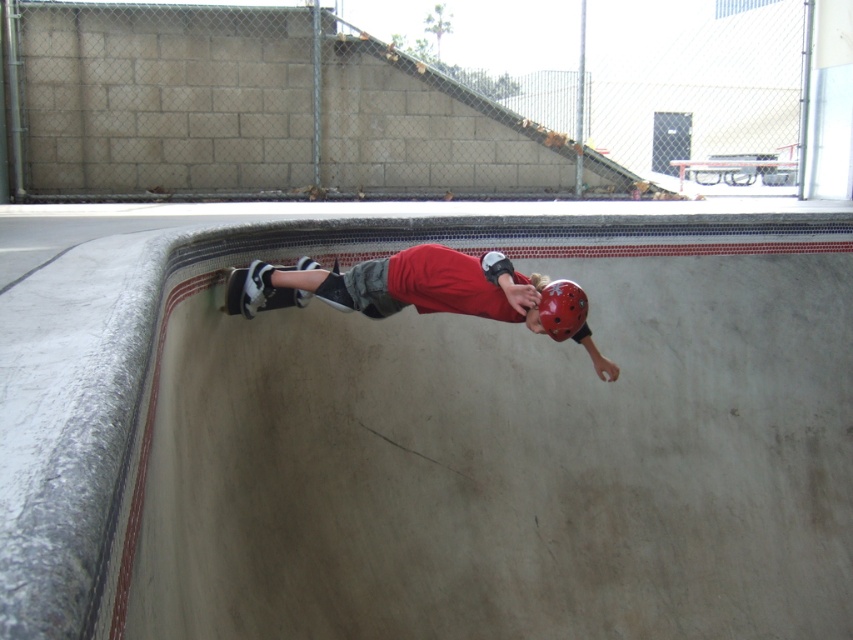
Is red matte helmet at center smaller than matte red helmet at center?

No.

Can you confirm if red matte helmet at center is positioned to the right of matte red helmet at center?

No, red matte helmet at center is not to the right of matte red helmet at center.

What do you see at coordinates (408, 285) in the screenshot? The width and height of the screenshot is (853, 640). I see `red matte helmet at center` at bounding box center [408, 285].

Where is `red matte helmet at center`? The width and height of the screenshot is (853, 640). red matte helmet at center is located at coordinates (408, 285).

Can you confirm if matte red helmet at center is smaller than white rubber skateboard at lower left?

Incorrect, matte red helmet at center is not smaller in size than white rubber skateboard at lower left.

Which is in front, point (553, 330) or point (238, 308)?

Point (553, 330) is in front.

Is point (564, 300) closer to camera compared to point (231, 312)?

Yes, point (564, 300) is in front of point (231, 312).

Find the location of a particular element. The width and height of the screenshot is (853, 640). matte red helmet at center is located at coordinates (563, 310).

Can you confirm if red matte helmet at center is thinner than white rubber skateboard at lower left?

Incorrect, red matte helmet at center's width is not less than white rubber skateboard at lower left's.

Is point (262, 284) positioned before point (231, 301)?

No, it is behind (231, 301).

Describe the element at coordinates (408, 285) in the screenshot. I see `red matte helmet at center` at that location.

Where is `red matte helmet at center`? red matte helmet at center is located at coordinates (408, 285).